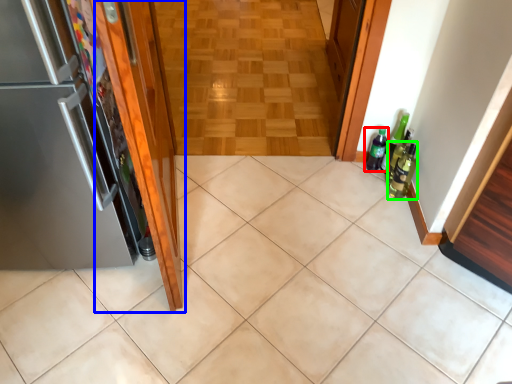
Question: Considering the real-world distances, which object is farthest from bottle (highlighted by a red box)? door (highlighted by a blue box) or beer bottle (highlighted by a green box)?

Choices:
 (A) door
 (B) beer bottle

Answer: (A)